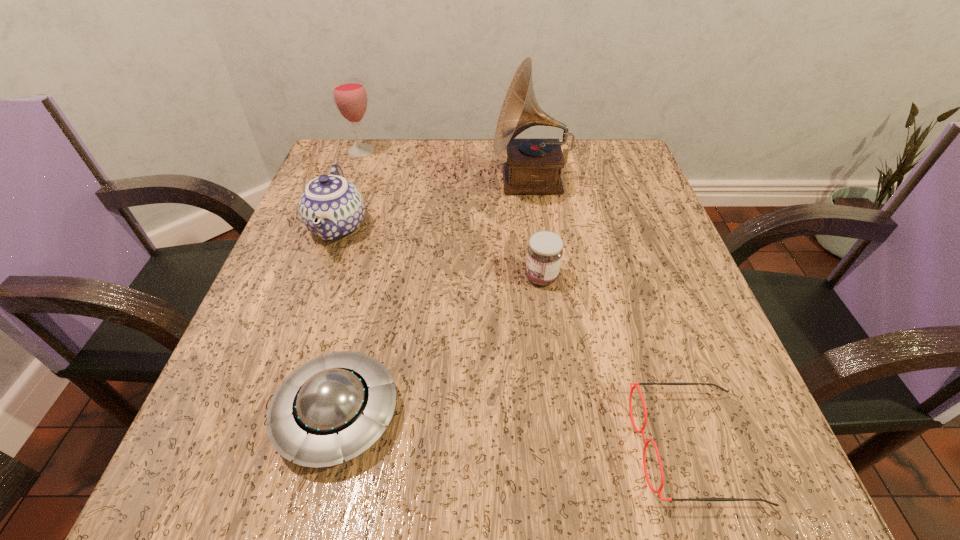
This screenshot has height=540, width=960. I want to click on vacant space at the far edge of the desktop, so click(x=428, y=158).

This screenshot has height=540, width=960. I want to click on vacant space at the near edge of the desktop, so click(x=609, y=491).

The height and width of the screenshot is (540, 960). I want to click on free space at the right edge, so click(720, 405).

Image resolution: width=960 pixels, height=540 pixels. Identify the location of free space at the far left corner of the desktop. (329, 173).

In the image, there is a desktop. Where is `vacant area at the near left corner`? Image resolution: width=960 pixels, height=540 pixels. vacant area at the near left corner is located at coordinates (185, 476).

The height and width of the screenshot is (540, 960). Identify the location of vacant space at the far right corner. click(630, 195).

At what (x,y) coordinates should I click in order to perform the action: click on free space between the shortest object and the third nearest object. Please return your answer as a coordinate pair (x, y). This screenshot has height=540, width=960. Looking at the image, I should click on (617, 362).

I want to click on free space between the rightmost object and the fourth farthest object, so point(617,362).

Image resolution: width=960 pixels, height=540 pixels. I want to click on free space between the third tallest object and the jam, so click(x=440, y=252).

Find the location of a particular element. Image resolution: width=960 pixels, height=540 pixels. vacant space in between the phonograph record and the rightmost object is located at coordinates (x=612, y=314).